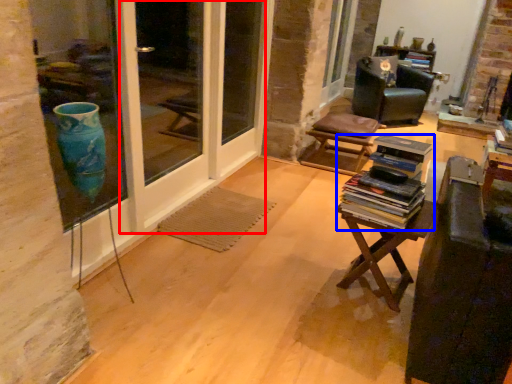
Question: Which point is closer to the camera, screen door (highlighted by a red box) or book (highlighted by a blue box)?

Choices:
 (A) screen door
 (B) book

Answer: (B)